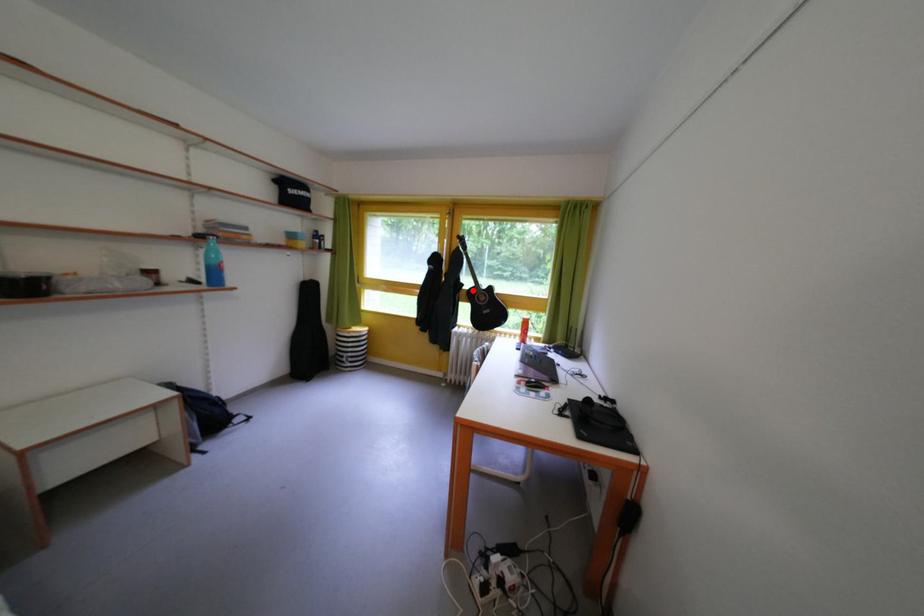
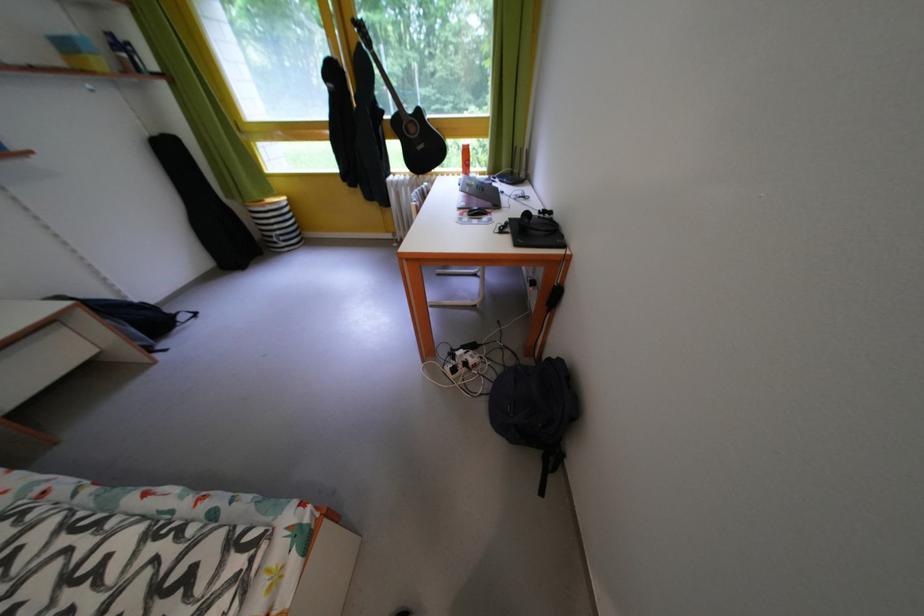
Question: A red point is marked in image1. In image2, is the corresponding 3D point closer to the camera or farther? Reply with the corresponding letter.

Choices:
 (A) The corresponding 3D point is closer.
 (B) The corresponding 3D point is farther.

Answer: (A)